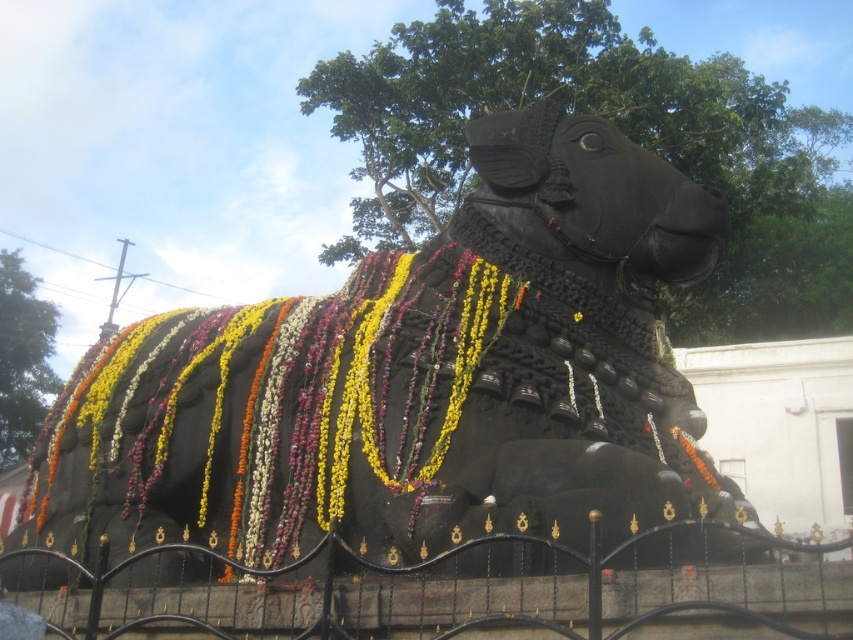
You are standing at the entrance of the outdoor area where the statue is located. You see the black polished stone bull at center marked by point [413,380]. If you walk straight ahead from your current position, will you move towards the bull or away from it?

Since the bull is at the center of the scene and you are at the entrance, walking straight ahead from your current position would move you towards the bull as it is centrally located.

You are standing in a garden and want to take a photo of the black polished stone bull at center and the black wrought iron fence at center. Which object should you focus on first to ensure it appears sharp in the foreground?

You should focus on the black polished stone bull at center first because it is closer to you than the black wrought iron fence at center, making it the foreground object.

In the scene shown: You are a gardener who needs to determine the appropriate size of a new floral arrangement to place between the floral garland at center and the black wrought iron fence at center. Based on their thickness, which object should the new arrangement match in size?

The floral garland at center is thinner than the black wrought iron fence at center, so the new arrangement should match the thickness of the floral garland at center to ensure it is proportionate.